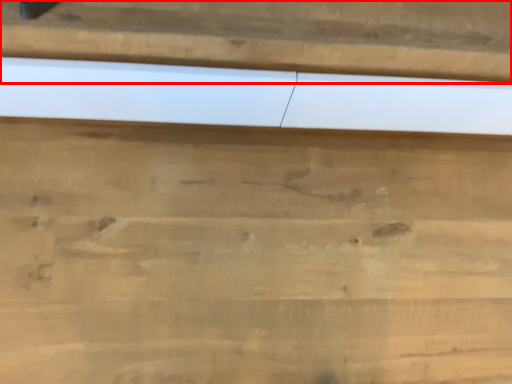
Question: Considering the relative positions of panel (annotated by the red box) and cutting board in the image provided, where is panel (annotated by the red box) located with respect to the staircase?

Choices:
 (A) right
 (B) left

Answer: (A)